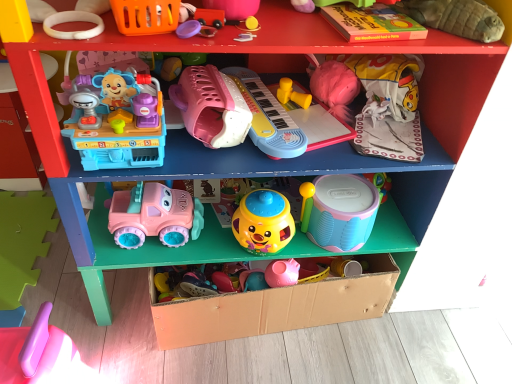
I want to click on vacant area that is situated to the right of yellow plastic toy at upper center, marked as the 4th toy in a right-to-left arrangement, so click(x=324, y=109).